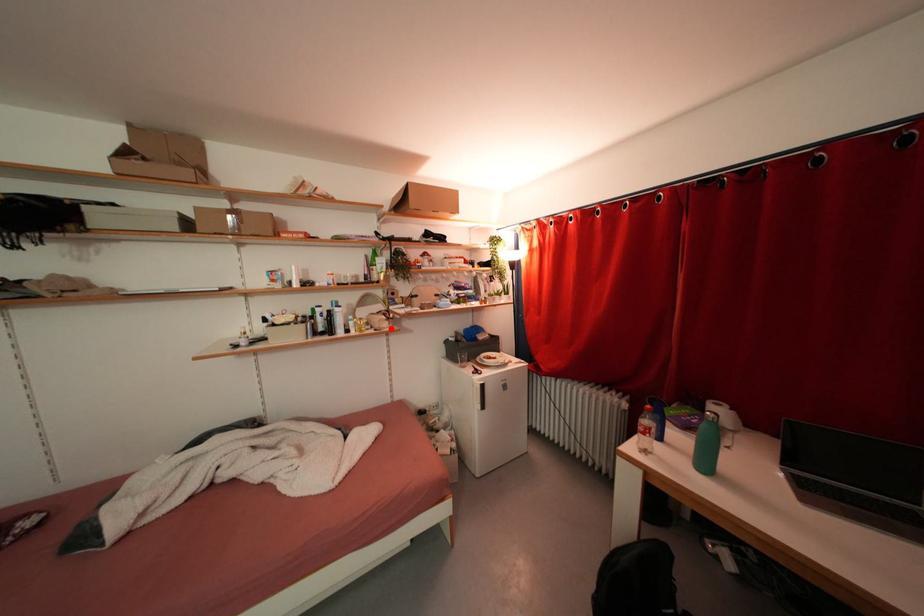
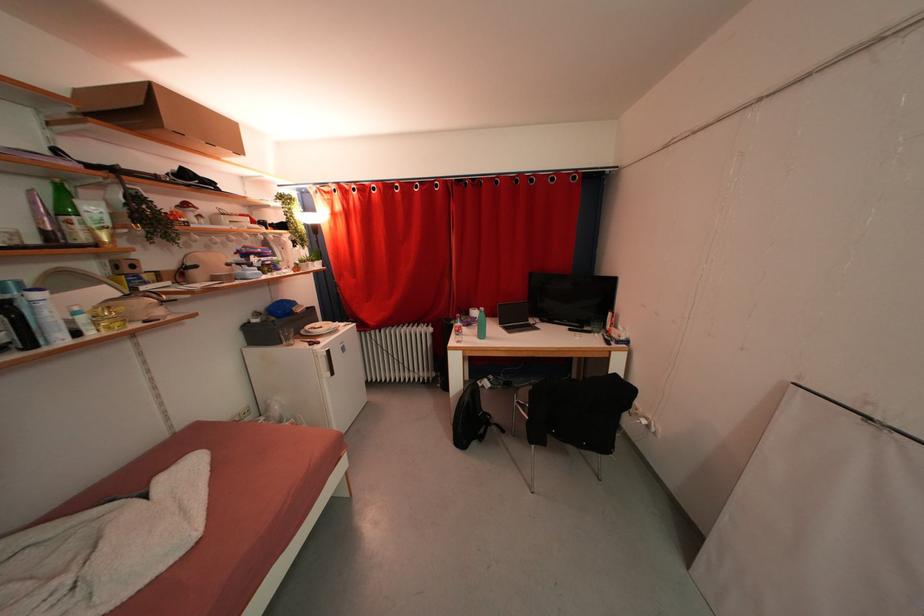
Locate, in the second image, the point that corresponds to the highlighted location in the first image.

(165, 315)